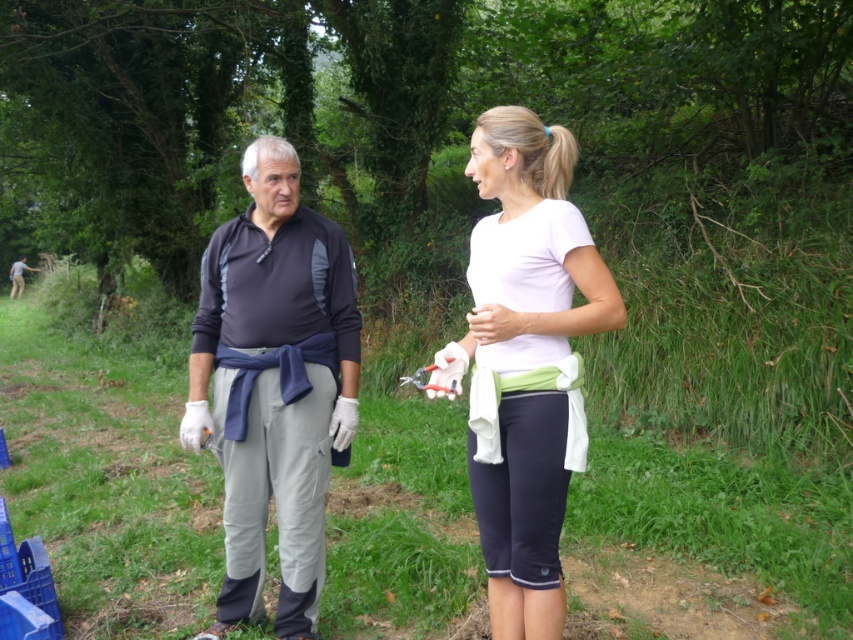
Question: Which point is closer to the camera taking this photo?

Choices:
 (A) (543, 435)
 (B) (553, 275)
 (C) (22, 282)
 (D) (239, 556)

Answer: (A)

Question: Which object is positioned farthest from the white matte t-shirt at center?

Choices:
 (A) dark gray fleece at center
 (B) matte black shirt at center

Answer: (A)

Question: Considering the relative positions of dark gray fleece at center and matte black shirt at center in the image provided, where is dark gray fleece at center located with respect to matte black shirt at center?

Choices:
 (A) below
 (B) above

Answer: (A)

Question: Does dark gray fleece at center have a lesser width compared to white matte t-shirt at center?

Choices:
 (A) no
 (B) yes

Answer: (A)

Question: Does dark gray fleece at center appear on the left side of white matte t-shirt at center?

Choices:
 (A) yes
 (B) no

Answer: (A)

Question: Which object is closer to the camera taking this photo?

Choices:
 (A) camouflage fabric shirt at left
 (B) white matte t-shirt at center
 (C) dark gray fleece at center
 (D) matte black shirt at center

Answer: (B)